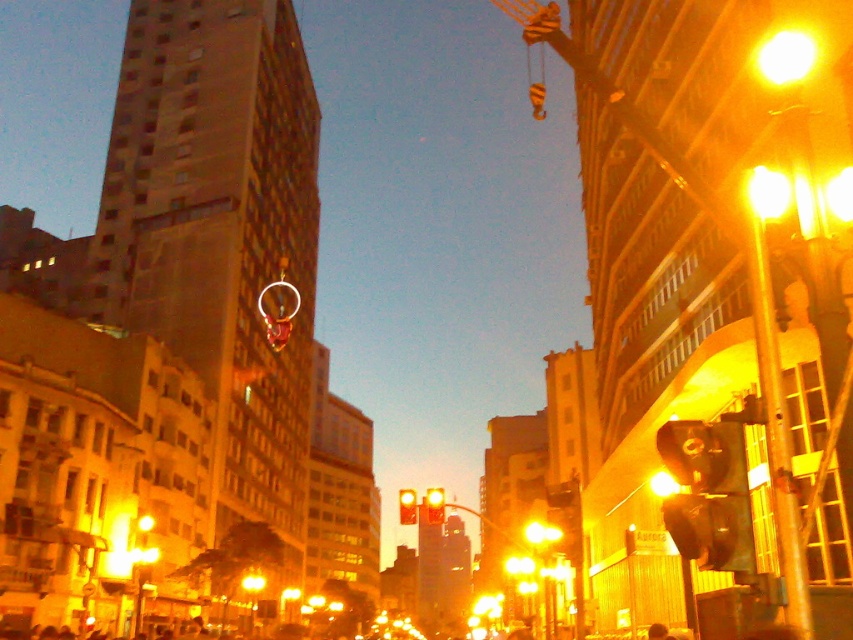
Question: Among these points, which one is farthest from the camera?

Choices:
 (A) (436, 493)
 (B) (398, 497)
 (C) (672, 513)

Answer: (B)

Question: Is matte black traffic light at right bigger than yellow matte traffic light at center?

Choices:
 (A) no
 (B) yes

Answer: (A)

Question: Is matte black traffic light at right smaller than yellow matte traffic light at center?

Choices:
 (A) yes
 (B) no

Answer: (A)

Question: Which object is closer to the camera taking this photo?

Choices:
 (A) yellow matte traffic light at center
 (B) matte black traffic light at right
 (C) yellow glass traffic light at center

Answer: (B)

Question: Which object is positioned farthest from the yellow glass traffic light at center?

Choices:
 (A) matte black traffic light at right
 (B) yellow matte traffic light at center

Answer: (B)

Question: Does matte black traffic light at right appear under yellow matte traffic light at center?

Choices:
 (A) no
 (B) yes

Answer: (A)